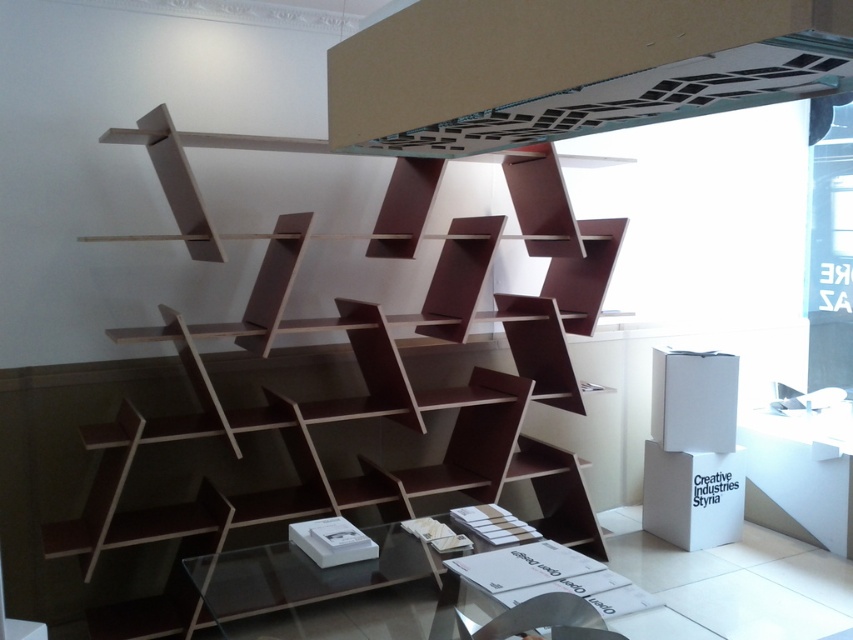
You are standing in front of the brown matte bookcase at center and want to reach the matte white exhaust hood at upper center. Which direction should you move to get there?

The brown matte bookcase at center is to the left of the matte white exhaust hood at upper center, so you should move to the right to reach the matte white exhaust hood at upper center.

You are an interior designer assessing the space in the image. You need to determine if the brown matte bookcase at center can be moved closer to the matte white exhaust hood at upper center without overlapping. Based on their widths, can they be placed side by side in the available space?

The brown matte bookcase at center is wider than the matte white exhaust hood at upper center. To place them side by side, the total width would be the sum of both, so the available space must accommodate this combined width. However, without knowing the exact dimensions of the available space, it is impossible to confirm if they can fit without overlapping.

You are standing at the glass table with dark surface in front of the brown matte bookcase at center. If you want to reach the nearest shelf on the bookcase, how many steps would you have to take? Assume each step covers 2.5 feet.

The distance between you and the brown matte bookcase at center is 7.91 feet. Since each step covers 2.5 feet, dividing 7.91 by 2.5 gives approximately 3.16 steps. Therefore, you would need to take 4 steps to reach the nearest shelf on the brown matte bookcase at center.